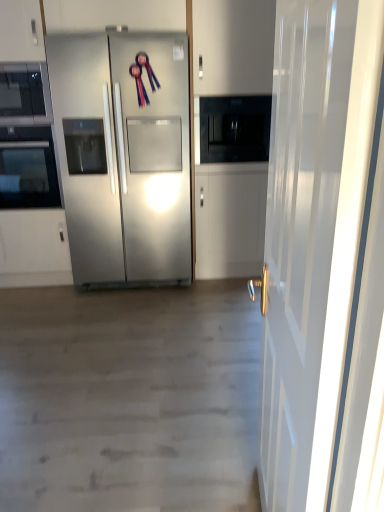
Question: From a real-world perspective, is matte black microwave at upper left physically located above or below black glass oven at left?

Choices:
 (A) below
 (B) above

Answer: (B)

Question: From their relative heights in the image, would you say matte black microwave at upper left is taller or shorter than black glass oven at left?

Choices:
 (A) short
 (B) tall

Answer: (A)

Question: Which of these objects is positioned closest to the stainless steel refrigerator at center?

Choices:
 (A) white glossy door at right
 (B) black glass microwave at center
 (C) black glass oven at left
 (D) matte black microwave at upper left

Answer: (C)

Question: Estimate the real-world distances between objects in this image. Which object is farther from the black glass microwave at center?

Choices:
 (A) stainless steel refrigerator at center
 (B) white glossy door at right
 (C) matte black microwave at upper left
 (D) black glass oven at left

Answer: (B)